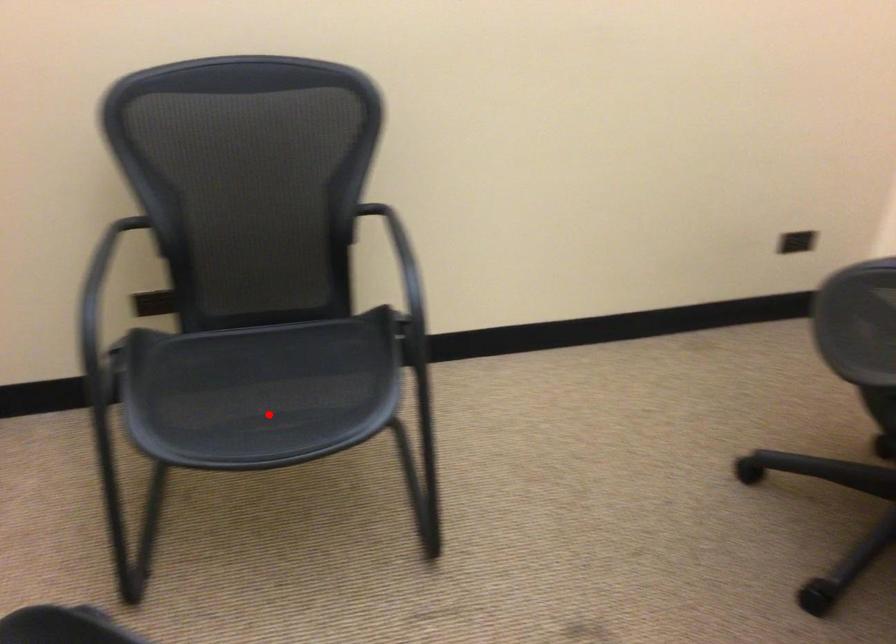
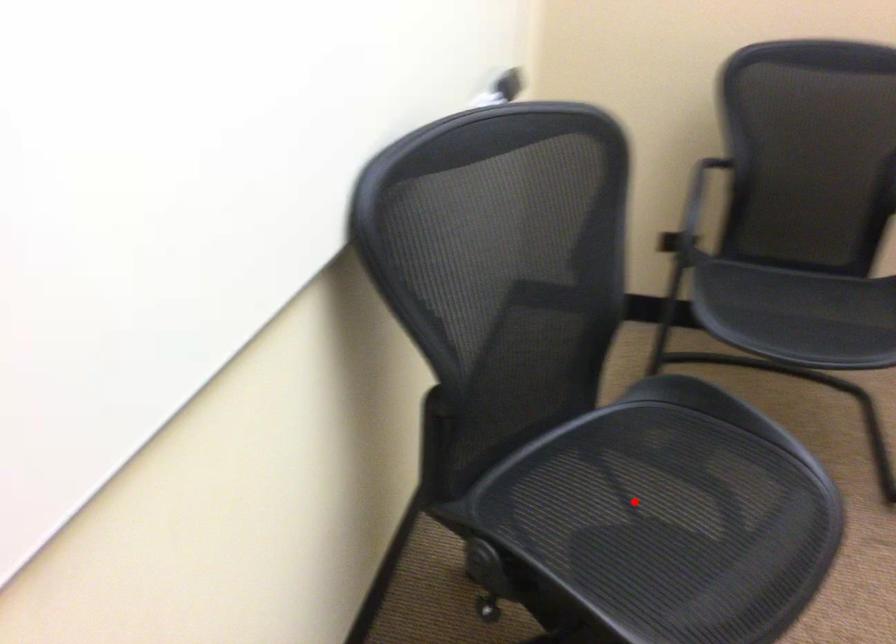
I am providing you with two images of the same scene from different viewpoints. A red point is marked on the first image and another point is marked on the second image. Does the point marked in image1 correspond to the same location as the one in image2?

No